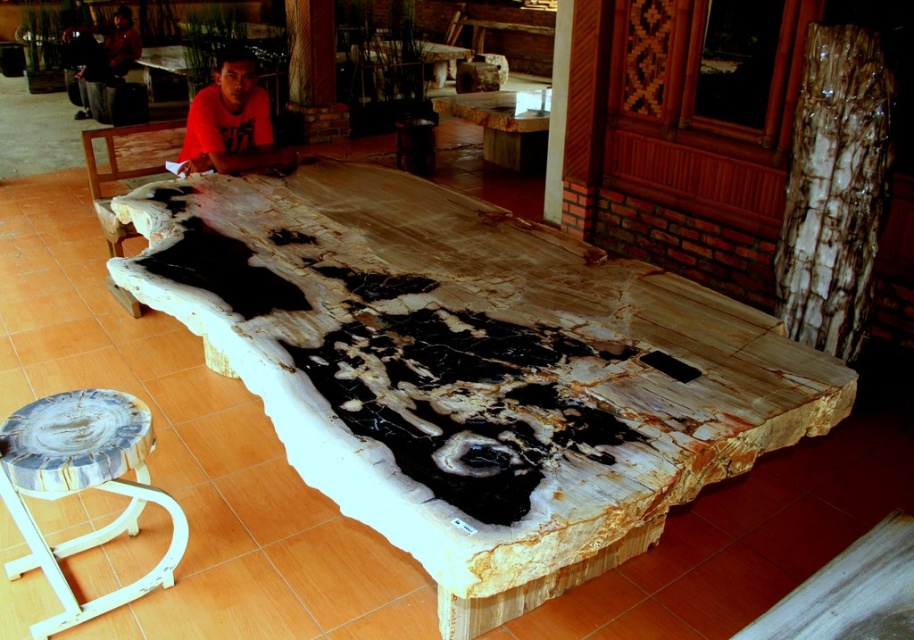
You are a tailor who needs to move a dress from the matte orange shirt at center to the dark brown leather jacket at upper left. The dress is 18 feet long. Can you move the dress without folding it?

The distance between the matte orange shirt at center and the dark brown leather jacket at upper left is 18.48 feet, so yes, the dress can be moved without folding since it is longer than the distance required.

You are an interior designer planning to place a new sofa in the room. The sofa is the same size as the natural wood stool at lower left. Will the sofa fit in the space where the polished wood table at center is currently located?

The natural wood stool at lower left is smaller than the polished wood table at center, so the sofa, being the same size as the stool, may not fit in the space where the table is currently located since the table occupies a larger area.

You are standing at the entrance of the workshop and want to place a new decorative item on the natural wood stool at lower left. According to the coordinates provided, where exactly should you place the item?

The natural wood stool at lower left is located at coordinates point (x=82, y=486), so you should place the decorative item there.